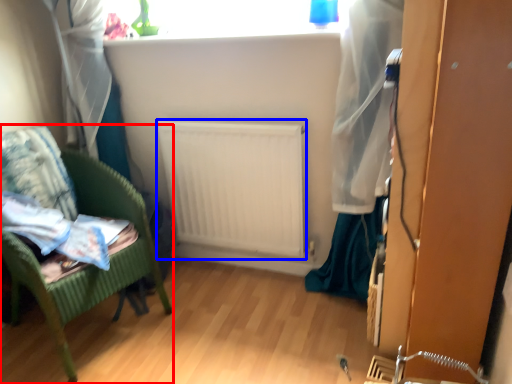
Question: Which object is closer to the camera taking this photo, furniture (highlighted by a red box) or radiator (highlighted by a blue box)?

Choices:
 (A) furniture
 (B) radiator

Answer: (A)